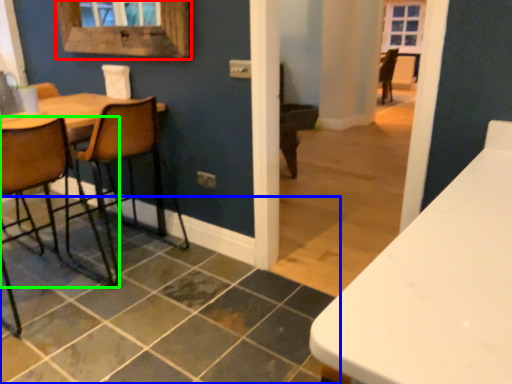
Question: Considering the real-world distances, which object is farthest from window frame (highlighted by a red box)? tile (highlighted by a blue box) or chair (highlighted by a green box)?

Choices:
 (A) tile
 (B) chair

Answer: (A)